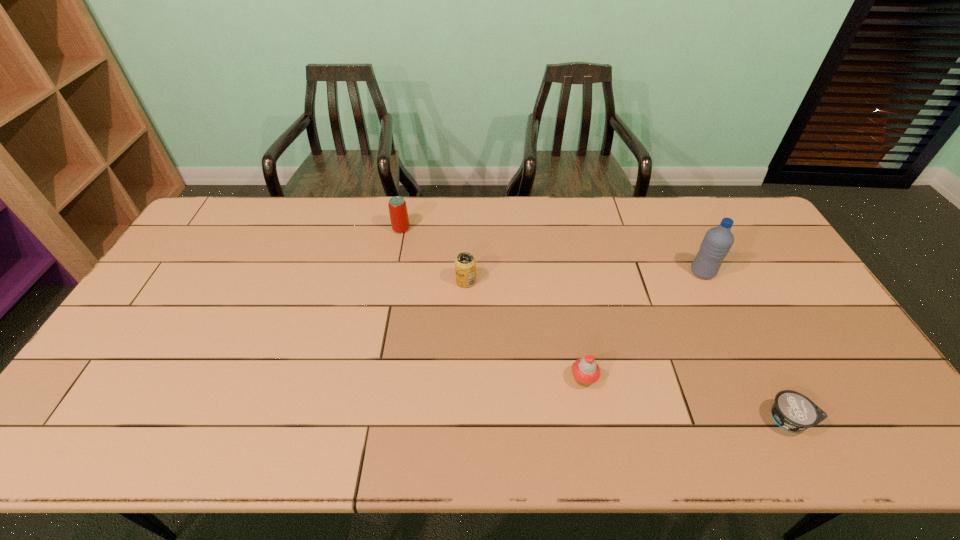
This screenshot has height=540, width=960. I want to click on free space located on the left of the farther beer can, so click(348, 229).

The image size is (960, 540). Identify the location of free spot located 0.310m on the back of the nearer beer can. (468, 213).

Where is `vacant area located 0.220m on the right of the third object from right to left`? This screenshot has width=960, height=540. vacant area located 0.220m on the right of the third object from right to left is located at coordinates (684, 379).

Find the location of a particular element. This screenshot has width=960, height=540. free space located on the left of the yogurt is located at coordinates (606, 419).

You are a GUI agent. You are given a task and a screenshot of the screen. Output one action in this format:
    pyautogui.click(x=<x>, y=<y>)
    Task: Click on the object that is at the far edge
    The height and width of the screenshot is (540, 960).
    Given the screenshot: What is the action you would take?
    pyautogui.click(x=398, y=212)

You are a GUI agent. You are given a task and a screenshot of the screen. Output one action in this format:
    pyautogui.click(x=<x>, y=<y>)
    Task: Click on the object at the near edge
    
    Given the screenshot: What is the action you would take?
    pyautogui.click(x=793, y=411)

Find the location of a particular element. The height and width of the screenshot is (540, 960). blank space at the far edge is located at coordinates (511, 225).

In the image, there is a desktop. Identify the location of free region at the near edge. (395, 432).

I want to click on vacant area at the right edge of the desktop, so click(x=804, y=307).

Image resolution: width=960 pixels, height=540 pixels. Identify the location of vacant space at the far right corner of the desktop. (741, 239).